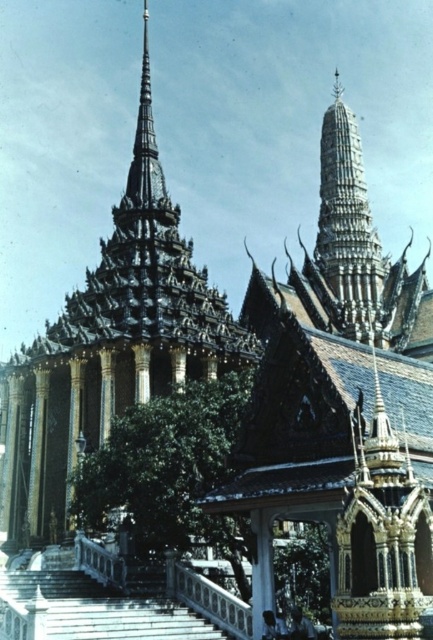
Based on the scene description, where is the shiny gold spire at center located in terms of its 2D coordinates?

The shiny gold spire at center is located at the 2D coordinates of point (109, 346).

You are an architect analyzing the temple structure. You observe the shiny gold spire at center and the silver metallic spire at center. Which one is taller?

The shiny gold spire at center is taller than the silver metallic spire at center according to the description.

You are standing in front of a grand Southeast Asian temple. You notice a point at coordinates (109, 346) on the image. What does this point most likely represent?

The point at coordinates (109, 346) most likely represents the shiny gold spire at center, as described in the objects description.